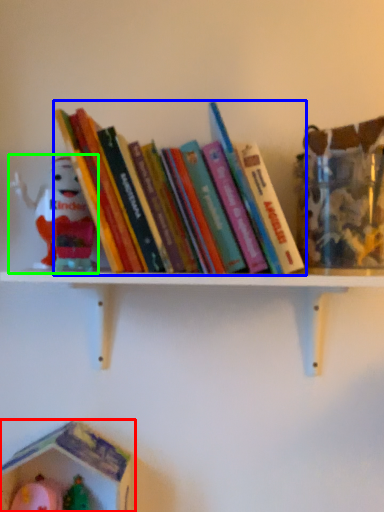
Question: Which object is the closest to the toy (highlighted by a red box)? Choose among these: book (highlighted by a blue box) or toy (highlighted by a green box).

Choices:
 (A) book
 (B) toy

Answer: (B)